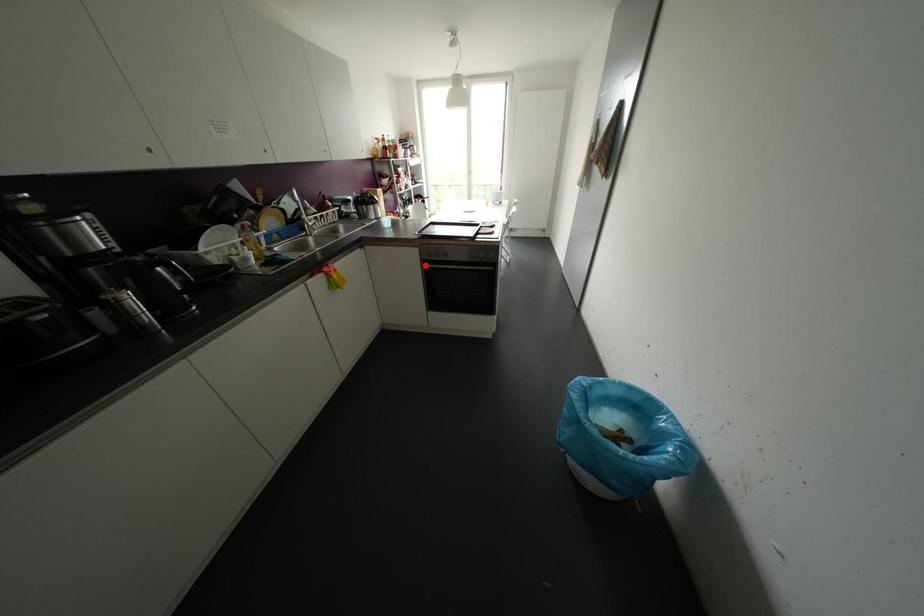
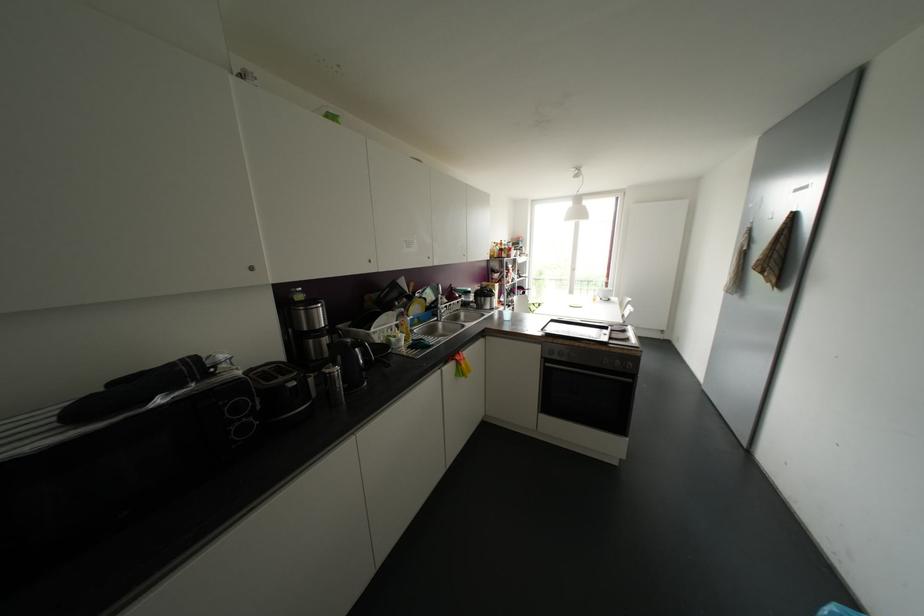
Locate, in the second image, the point that corresponds to the highlighted location in the first image.

(546, 363)